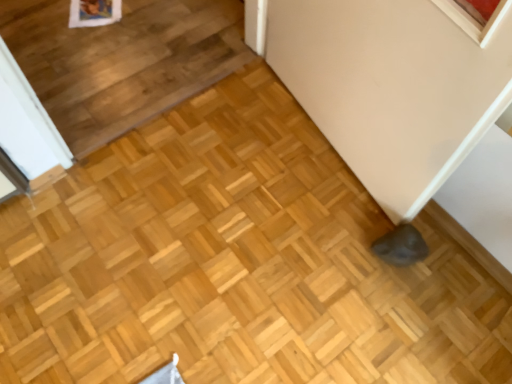
This screenshot has width=512, height=384. What are the coordinates of `white matte door at lower right` in the screenshot? It's located at (394, 85).

The height and width of the screenshot is (384, 512). Describe the element at coordinates (394, 85) in the screenshot. I see `white matte door at lower right` at that location.

This screenshot has width=512, height=384. I want to click on white matte door at lower right, so click(394, 85).